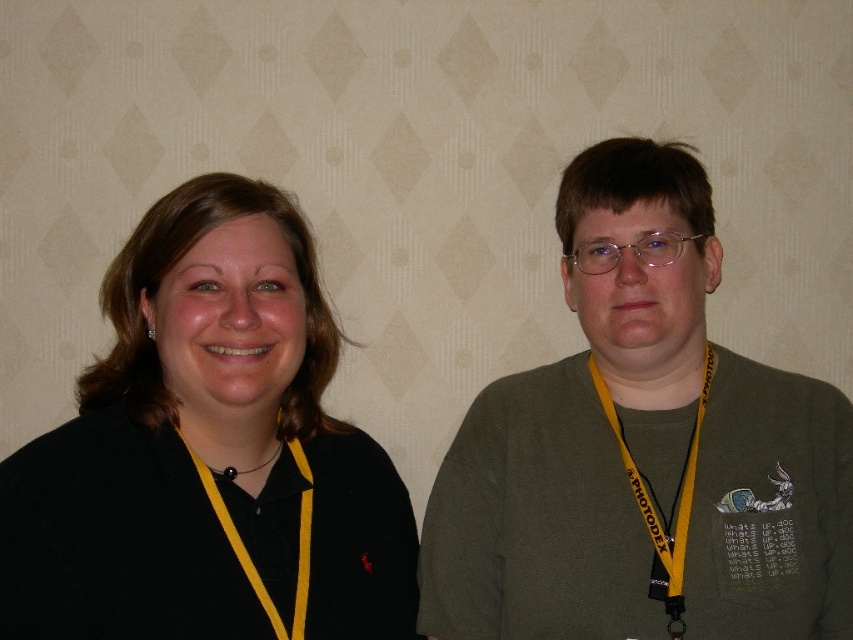
Question: Among these objects, which one is farthest from the camera?

Choices:
 (A) black fabric at center
 (B) black matte shirt at left
 (C) yellow fabric lanyard at right

Answer: (C)

Question: Is matte green sweater at right smaller than black fabric at center?

Choices:
 (A) no
 (B) yes

Answer: (A)

Question: Is matte green sweater at right positioned before black matte shirt at left?

Choices:
 (A) yes
 (B) no

Answer: (B)

Question: Which of the following is the closest to the observer?

Choices:
 (A) (128, 620)
 (B) (299, 529)
 (C) (271, 388)
 (D) (657, 401)

Answer: (A)

Question: Is matte green sweater at right behind yellow fabric lanyard at left?

Choices:
 (A) no
 (B) yes

Answer: (B)

Question: Estimate the real-world distances between objects in this image. Which object is closer to the matte green sweater at right?

Choices:
 (A) yellow fabric lanyard at left
 (B) skinny yellow lanyard at center
 (C) black fabric at center

Answer: (B)